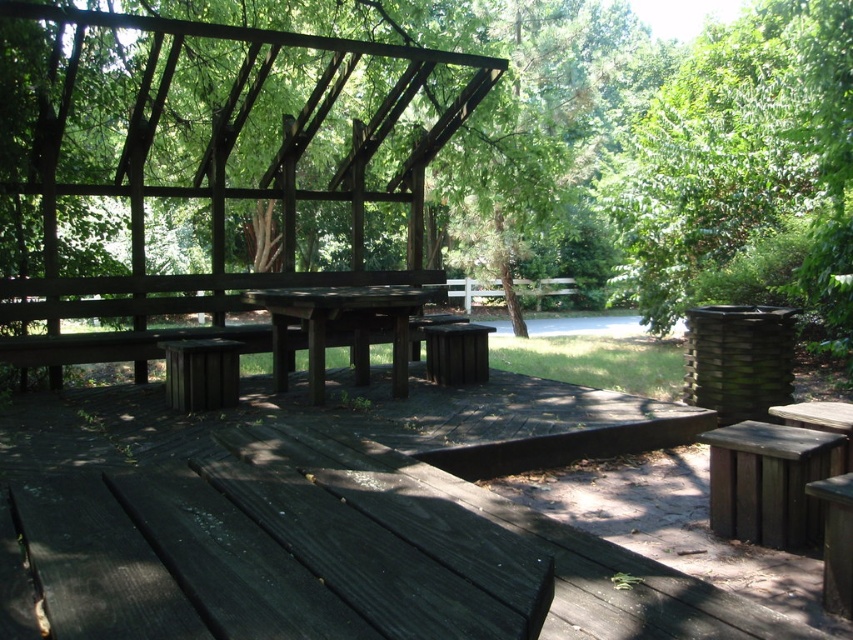
You are planning to set up a small group activity in the pavilion. You need to move the dark brown wood bench at lower right so that it is directly in front of the dark brown wooden table at center. Is this possible given their current positions?

The dark brown wood bench at lower right is currently to the right of the dark brown wooden table at center. To place it directly in front, you would need to move it from the right side to the front, which is feasible as they are positioned in different directions relative to the table.

You are standing at the entrance of the outdoor wooden pavilion and want to locate two specific points. The first point is at coordinates point (612,170) and the second is at point (292,292). Which point is closer to your current position?

Point (292,292) is closer to your current position because it is nearer to the camera than point (612,170).

You are planning to set up a small reading corner in the pavilion. You have a tall bookshelf that is 1.2 meters in height. Can you place the bookshelf between the dark brown wood bench at lower right and the dark brown wooden table at center without it hitting the roof?

The dark brown wood bench at lower right is not as tall as the dark brown wooden table at center, but the height of the bookshelf is 1.2 meters. Since the pavilion has a triangular roof with a slanted design, the vertical clearance might vary. However, the description does not provide specific height measurements for the roof or the existing objects. Therefore, it is uncertain whether the bookshelf will fit without hitting the roof.